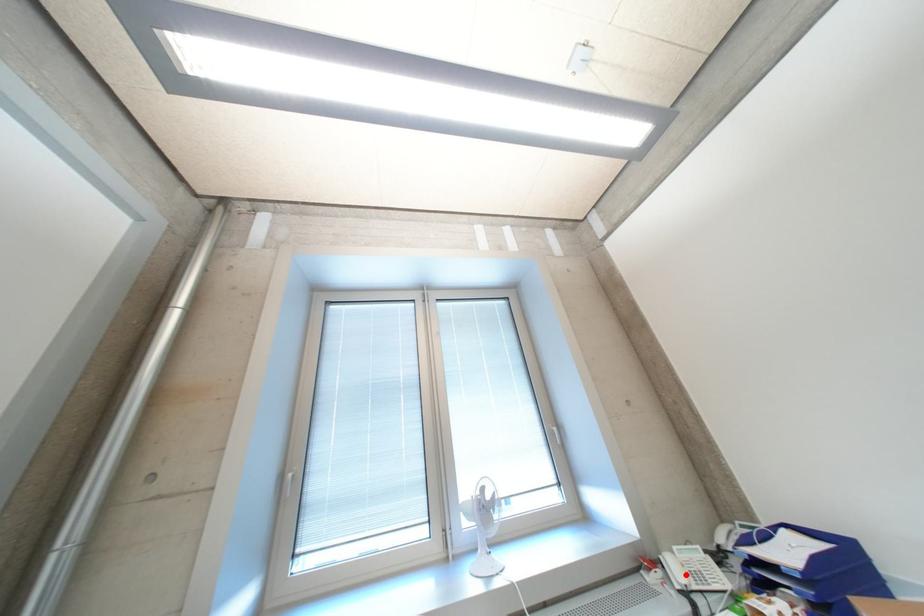
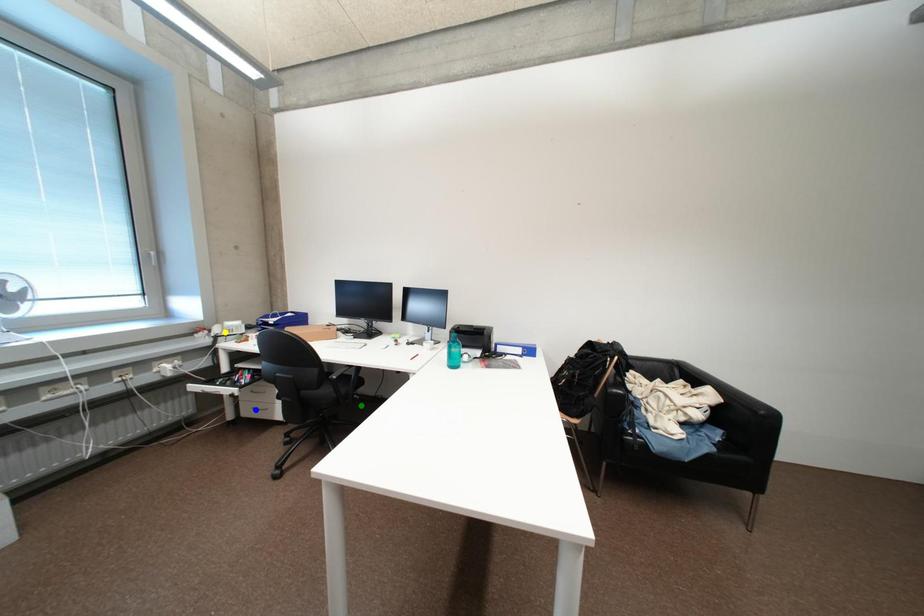
Question: I am providing you with two images of the same scene from different viewpoints. A red point is marked on the first image. You are given multiple points on the second image. Can you choose the point in image 2 that corresponds to the point in image 1?

Choices:
 (A) yellow point
 (B) blue point
 (C) green point

Answer: (A)